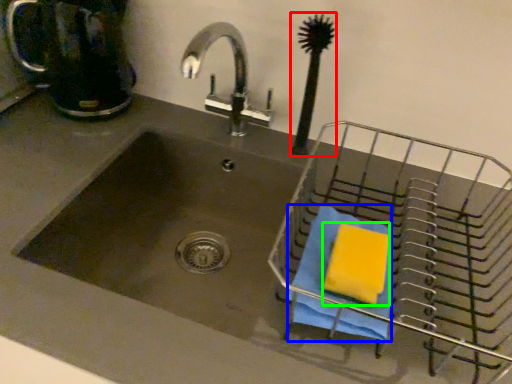
Question: Estimate the real-world distances between objects in this image. Which object is farther from brush (highlighted by a red box), beach towel (highlighted by a blue box) or soap (highlighted by a green box)?

Choices:
 (A) beach towel
 (B) soap

Answer: (B)